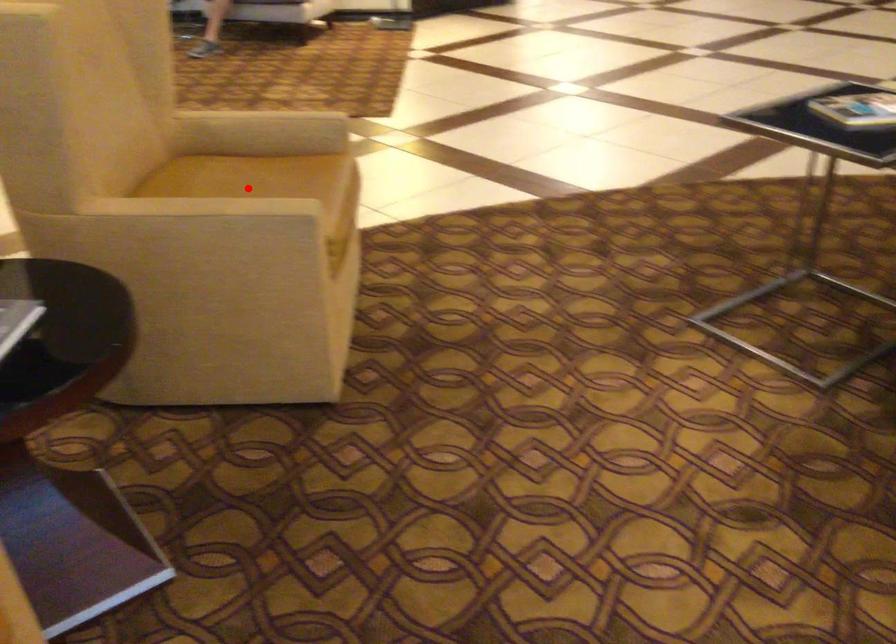
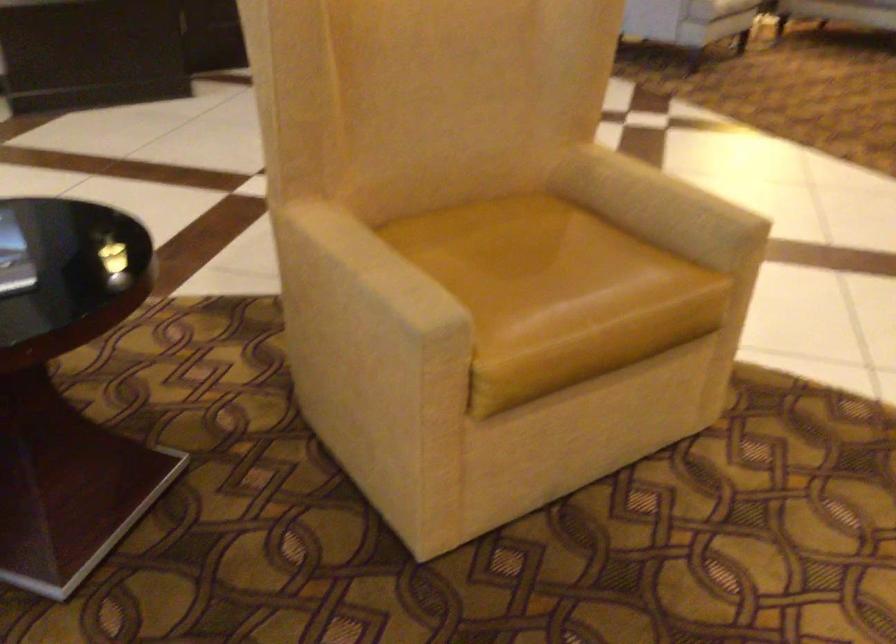
Where in the second image is the point corresponding to the highlighted location from the first image?

(520, 256)